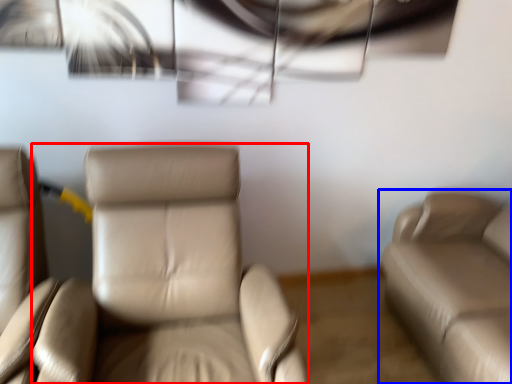
Question: Which of the following is the farthest to the observer, chair (highlighted by a red box) or studio couch (highlighted by a blue box)?

Choices:
 (A) chair
 (B) studio couch

Answer: (B)